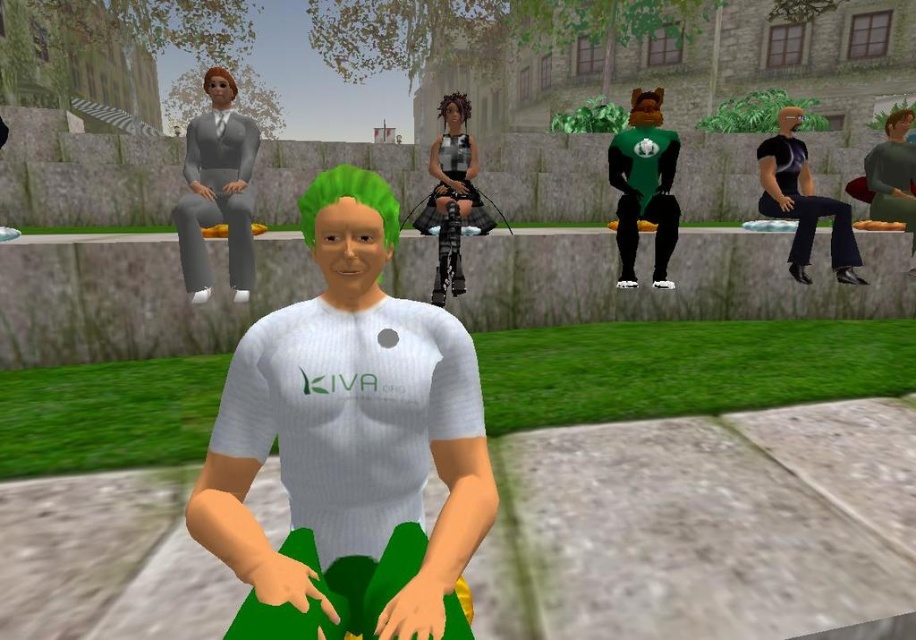
Question: Can you confirm if matte gray suit at left is positioned above green matte t-shirt at right?

Choices:
 (A) yes
 (B) no

Answer: (A)

Question: Which point is closer to the camera?

Choices:
 (A) (798, 116)
 (B) (887, 148)
 (C) (640, 141)
 (D) (182, 246)

Answer: (D)

Question: Does white ribbed shirt at center have a larger size compared to shiny brown hair at center?

Choices:
 (A) no
 (B) yes

Answer: (A)

Question: Which of these objects is positioned closest to the shiny brown hair at center?

Choices:
 (A) green matte t-shirt at right
 (B) plaid fabric skirt at center
 (C) blonde hair at upper left
 (D) matte gray suit at left

Answer: (A)

Question: Considering the relative positions of green spiky hair at center and blonde hair at upper left in the image provided, where is green spiky hair at center located with respect to blonde hair at upper left?

Choices:
 (A) below
 (B) above

Answer: (A)

Question: Which point is farther to the camera?

Choices:
 (A) plaid fabric skirt at center
 (B) shiny brown hair at center
 (C) green spiky hair at center

Answer: (B)